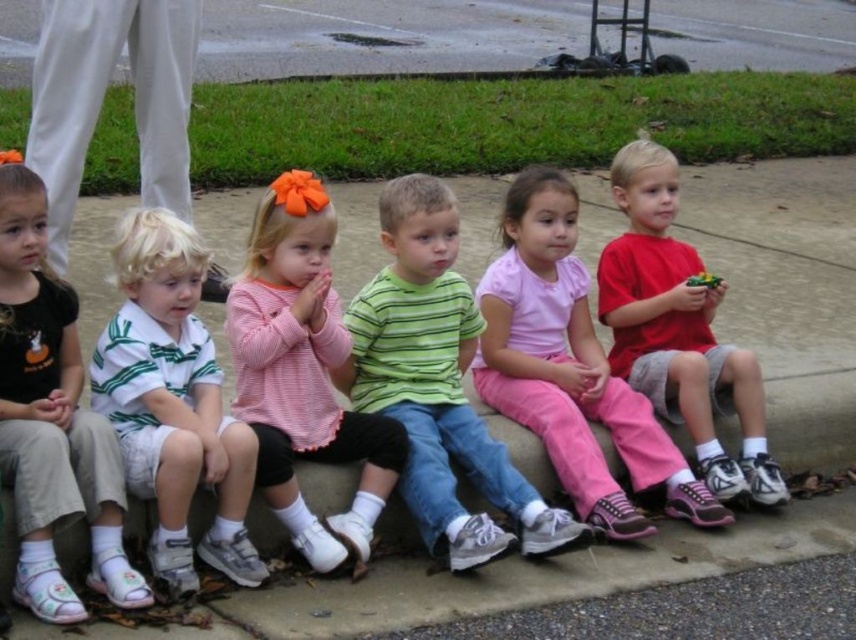
Who is more distant from viewer, (x=547, y=262) or (x=40, y=390)?

The point (x=547, y=262) is behind.

Does point (565, 388) come behind point (1, 464)?

Yes, point (565, 388) is farther from viewer.

Who is more distant from viewer, (614, 435) or (103, 420)?

The point (614, 435) is behind.

You are a GUI agent. You are given a task and a screenshot of the screen. Output one action in this format:
    pyautogui.click(x=<x>, y=<y>)
    Task: Click on the pink cotton pants at center
    This screenshot has height=640, width=856.
    Given the screenshot: What is the action you would take?
    pyautogui.click(x=571, y=369)

The width and height of the screenshot is (856, 640). Find the location of `white striped polo shirt at center`. white striped polo shirt at center is located at coordinates (173, 401).

Is white striped polo shirt at center positioned at the back of white striped polo shirt at left?

That is True.

Where is `white striped polo shirt at center`? The width and height of the screenshot is (856, 640). white striped polo shirt at center is located at coordinates (173, 401).

The image size is (856, 640). In order to click on white striped polo shirt at center in this screenshot , I will do `click(173, 401)`.

Who is taller, pink fabric shirt at center or red matte shirt at right?

red matte shirt at right is taller.

Does point (248, 300) come closer to viewer compared to point (732, 476)?

That is True.

Locate an element on the screen. This screenshot has height=640, width=856. pink fabric shirt at center is located at coordinates (302, 372).